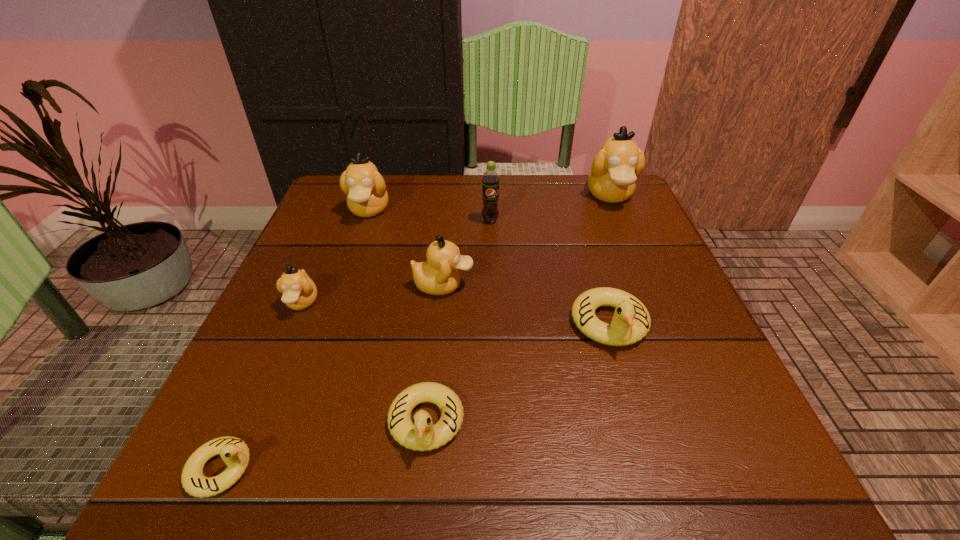
Select which object is the fourth closest to the second yellow duckling from left to right. Please provide its 2D coordinates. Your answer should be formatted as a tuple, i.e. [(x, y)], where the tuple contains the x and y coordinates of a point satisfying the conditions above.

[(299, 291)]

Locate which object ranks in proximity to the sixth object from left to right. Please provide its 2D coordinates. Your answer should be formatted as a tuple, i.e. [(x, y)], where the tuple contains the x and y coordinates of a point satisfying the conditions above.

[(439, 275)]

Select which duckling is the second closest to the smallest tan duckling. Please provide its 2D coordinates. Your answer should be formatted as a tuple, i.e. [(x, y)], where the tuple contains the x and y coordinates of a point satisfying the conditions above.

[(365, 188)]

Locate which duckling ranks sixth in proximity to the second shortest object. Please provide its 2D coordinates. Your answer should be formatted as a tuple, i.e. [(x, y)], where the tuple contains the x and y coordinates of a point satisfying the conditions above.

[(614, 171)]

The width and height of the screenshot is (960, 540). Identify the location of the second closest tan duckling to the shortest object. (439, 275).

Identify which tan duckling is the second closest to the smallest tan duckling. Please provide its 2D coordinates. Your answer should be formatted as a tuple, i.e. [(x, y)], where the tuple contains the x and y coordinates of a point satisfying the conditions above.

[(365, 188)]

Locate an element on the screen. This screenshot has height=540, width=960. the second closest yellow duckling relative to the third tan duckling from left to right is located at coordinates (420, 435).

Choose which yellow duckling is the nearest neighbor to the soda. Please provide its 2D coordinates. Your answer should be formatted as a tuple, i.e. [(x, y)], where the tuple contains the x and y coordinates of a point satisfying the conditions above.

[(631, 321)]

Where is `free spot that satisfies the following two spatial constraints: 1. on the face of the second tallest duckling; 2. on the face of the shortest duckling`? free spot that satisfies the following two spatial constraints: 1. on the face of the second tallest duckling; 2. on the face of the shortest duckling is located at coordinates (278, 469).